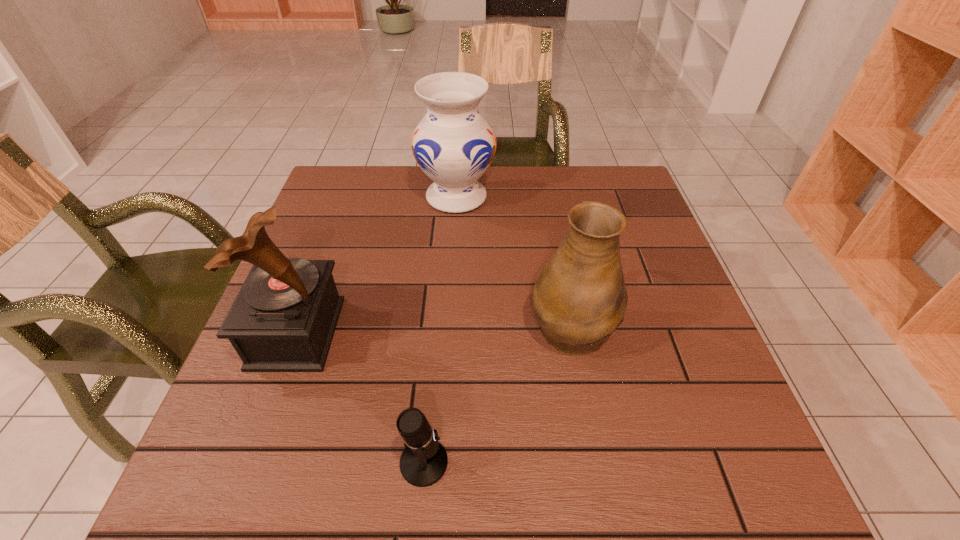
The height and width of the screenshot is (540, 960). In order to click on vacant area between the rightmost object and the shortest object in this screenshot , I will do `click(497, 394)`.

You are a GUI agent. You are given a task and a screenshot of the screen. Output one action in this format:
    pyautogui.click(x=<x>, y=<y>)
    Task: Click on the empty space between the pitcher and the shortest object
    
    Given the screenshot: What is the action you would take?
    pyautogui.click(x=497, y=394)

Where is `free point between the shortest object and the leftmost object`? The height and width of the screenshot is (540, 960). free point between the shortest object and the leftmost object is located at coordinates (361, 397).

The image size is (960, 540). What are the coordinates of `free spot between the farthest object and the rightmost object` in the screenshot? It's located at (514, 261).

At what (x,y) coordinates should I click in order to perform the action: click on free space between the phonograph_record and the pitcher. Please return your answer as a coordinate pair (x, y). Image resolution: width=960 pixels, height=540 pixels. Looking at the image, I should click on (434, 329).

This screenshot has height=540, width=960. I want to click on free space between the farthest object and the pitcher, so click(514, 261).

Where is `vacant area between the phonograph_record and the rightmost object`? The image size is (960, 540). vacant area between the phonograph_record and the rightmost object is located at coordinates (434, 329).

Where is `free area in between the leftmost object and the vase`? This screenshot has height=540, width=960. free area in between the leftmost object and the vase is located at coordinates (376, 265).

You are a GUI agent. You are given a task and a screenshot of the screen. Output one action in this format:
    pyautogui.click(x=<x>, y=<y>)
    Task: Click on the vacant space in between the phonograph_record and the vase
    
    Given the screenshot: What is the action you would take?
    (x=376, y=265)

You are a GUI agent. You are given a task and a screenshot of the screen. Output one action in this format:
    pyautogui.click(x=<x>, y=<y>)
    Task: Click on the object identified as the closest to the shortest object
    Image resolution: width=960 pixels, height=540 pixels.
    Given the screenshot: What is the action you would take?
    pyautogui.click(x=580, y=298)